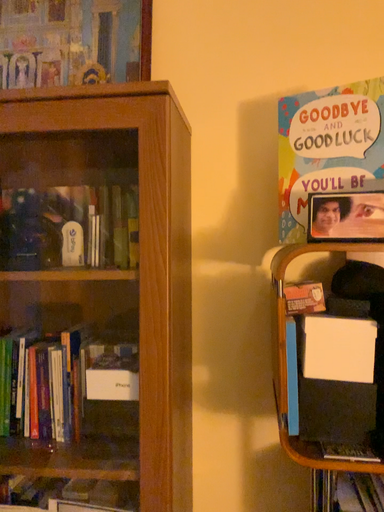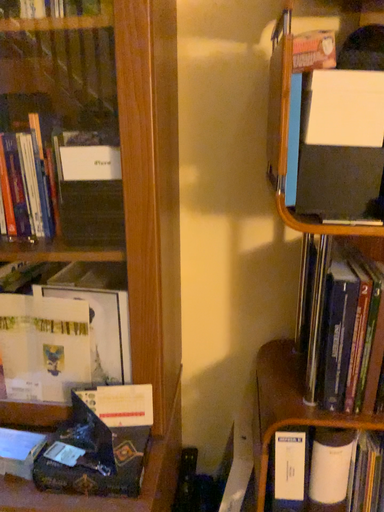
Question: Which way did the camera rotate in the video?

Choices:
 (A) rotated upward
 (B) rotated downward

Answer: (B)